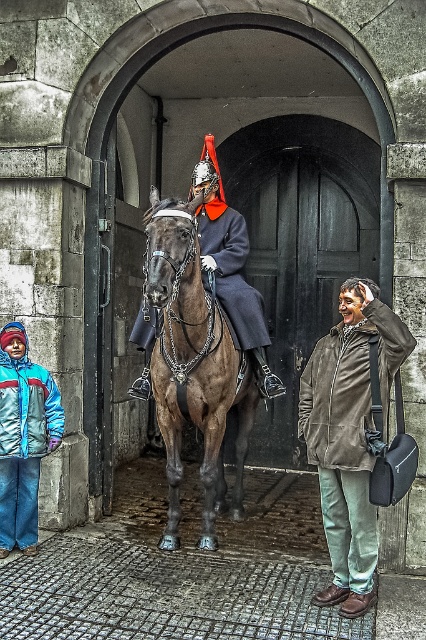
Question: Is brown glossy horse at center to the left of brown leather jacket at lower right from the viewer's perspective?

Choices:
 (A) yes
 (B) no

Answer: (A)

Question: Which point is farther from the camera taking this photo?

Choices:
 (A) (147, 340)
 (B) (362, 353)

Answer: (A)

Question: Is brown leather jacket at lower right wider than shiny black uniform at center?

Choices:
 (A) no
 (B) yes

Answer: (A)

Question: Based on their relative distances, which object is nearer to the brown glossy horse at center?

Choices:
 (A) brown leather jacket at lower right
 (B) shiny black uniform at center

Answer: (B)

Question: Estimate the real-world distances between objects in this image. Which object is farther from the brown glossy horse at center?

Choices:
 (A) brown leather jacket at lower right
 (B) shiny black uniform at center

Answer: (A)

Question: Is brown leather jacket at lower right to the left of shiny black uniform at center from the viewer's perspective?

Choices:
 (A) no
 (B) yes

Answer: (A)